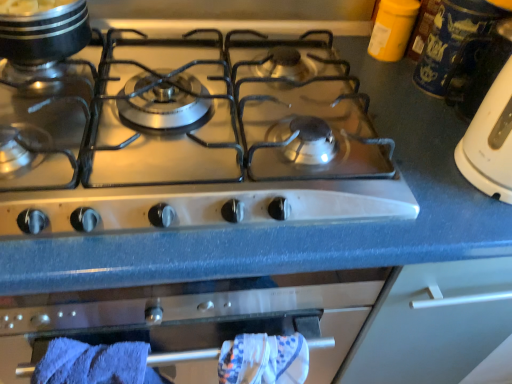
Question: From a real-world perspective, is satin silver gas stove at center above or below shiny metallic pot at upper left?

Choices:
 (A) below
 (B) above

Answer: (A)

Question: From the image's perspective, is satin silver gas stove at center positioned above or below shiny metallic pot at upper left?

Choices:
 (A) below
 (B) above

Answer: (A)

Question: Estimate the real-world distances between objects in this image. Which object is closer to the shiny metallic pot at upper left?

Choices:
 (A) blue ceramic mug at upper right
 (B) blue soft towel at lower left
 (C) satin silver gas stove at center

Answer: (C)

Question: Which of these objects is positioned farthest from the shiny metallic pot at upper left?

Choices:
 (A) blue ceramic mug at upper right
 (B) blue soft towel at lower left
 (C) satin silver gas stove at center

Answer: (A)